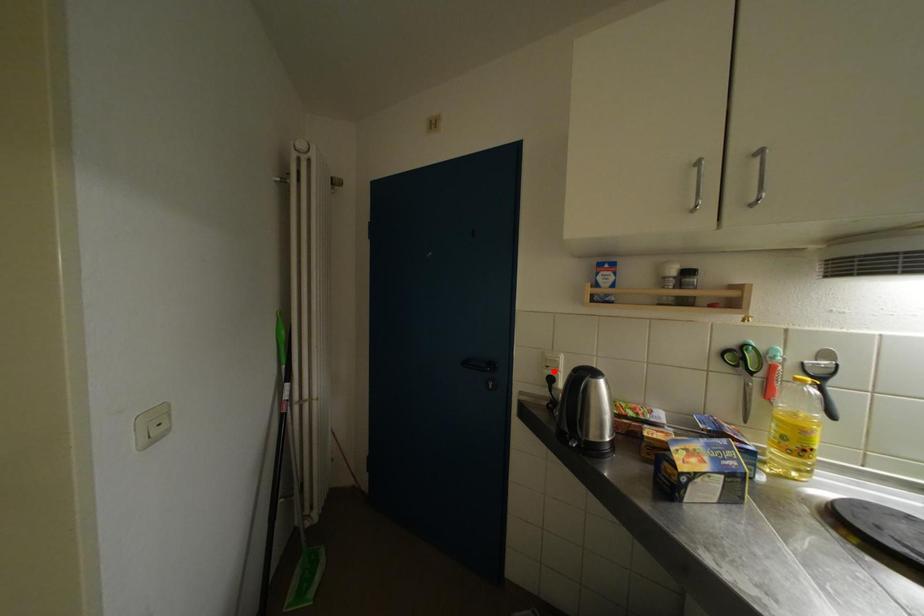
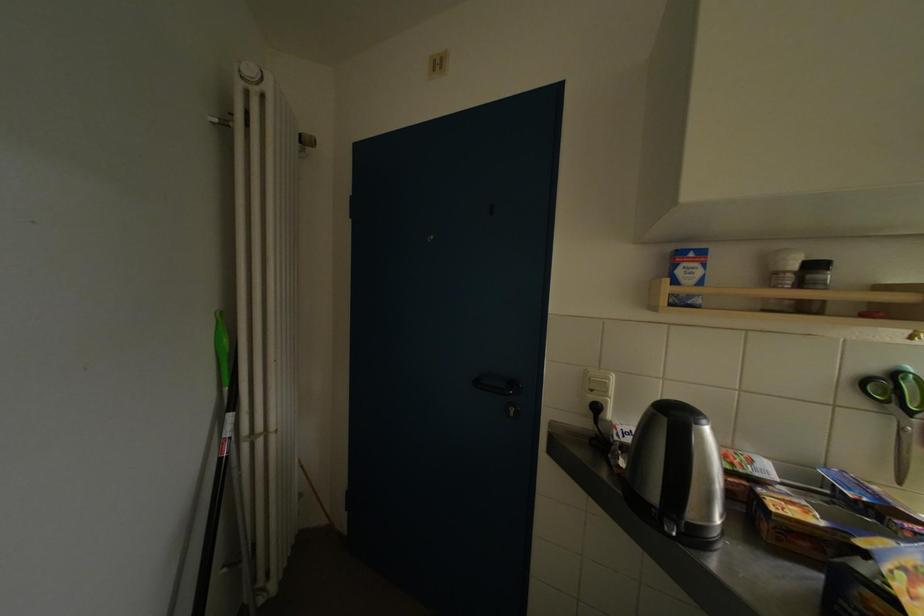
Locate, in the second image, the point that corresponds to the highlighted location in the first image.

(599, 394)